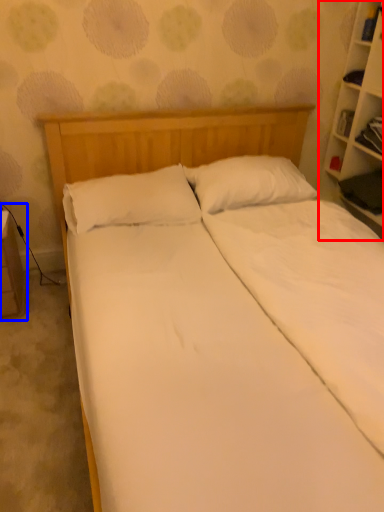
Question: Among these objects, which one is farthest to the camera, bookcase (highlighted by a red box) or table (highlighted by a blue box)?

Choices:
 (A) bookcase
 (B) table

Answer: (B)